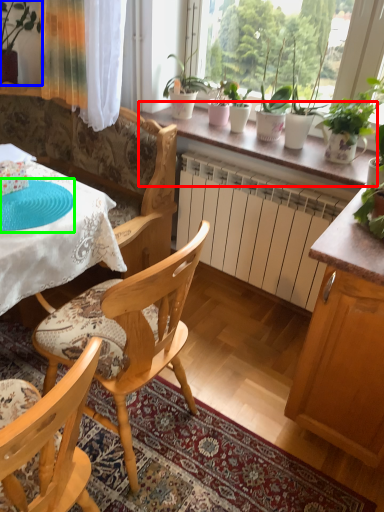
Question: Which is farther away from window sill (highlighted by a red box)? houseplant (highlighted by a blue box) or paper plate (highlighted by a green box)?

Choices:
 (A) houseplant
 (B) paper plate

Answer: (A)